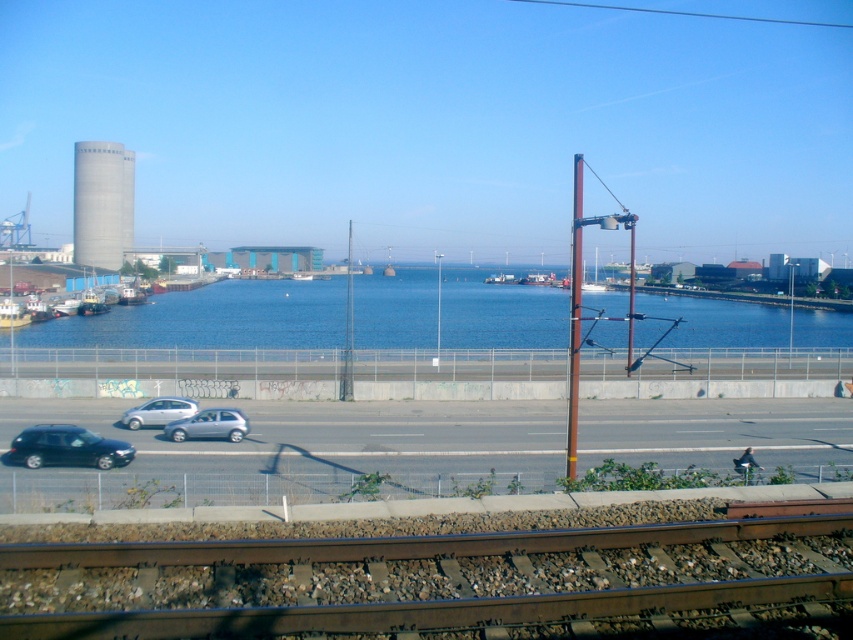
Question: Among these points, which one is nearest to the camera?

Choices:
 (A) (62, 456)
 (B) (807, 330)
 (C) (233, 426)

Answer: (A)

Question: Is gray concrete water tower at left positioned in front of silver metallic hatchback at lower left?

Choices:
 (A) yes
 (B) no

Answer: (B)

Question: Which object is positioned farthest from the shiny black car at lower left?

Choices:
 (A) blue water at center
 (B) satin silver hatchback at lower center
 (C) gray concrete water tower at left

Answer: (C)

Question: Does gray concrete water tower at left have a larger size compared to satin silver hatchback at lower center?

Choices:
 (A) no
 (B) yes

Answer: (B)

Question: Can you confirm if shiny black car at lower left is thinner than silver metallic hatchback at lower left?

Choices:
 (A) no
 (B) yes

Answer: (B)

Question: Which object is farther from the camera taking this photo?

Choices:
 (A) silver metallic hatchback at lower left
 (B) gray concrete water tower at left
 (C) blue water at center
 (D) satin silver hatchback at lower center

Answer: (B)